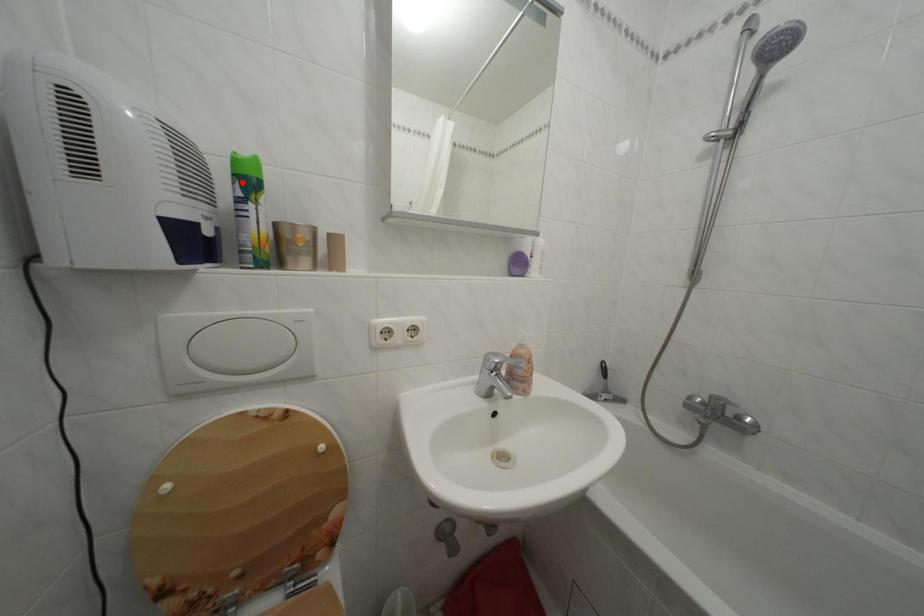
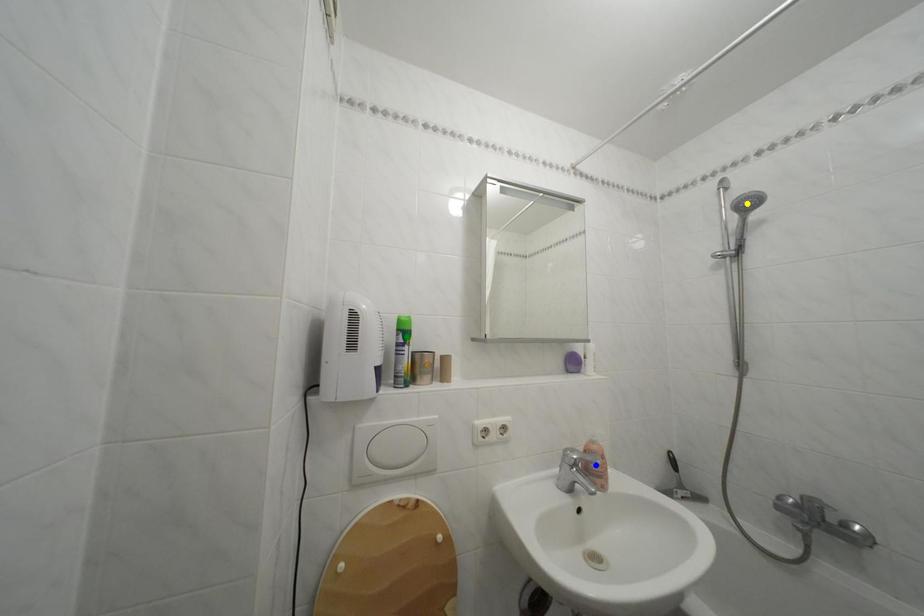
Question: I am providing you with two images of the same scene from different viewpoints. A red point is marked on the first image. You are given multiple points on the second image. Which mark in image 2 goes with the point in image 1?

Choices:
 (A) yellow point
 (B) green point
 (C) blue point

Answer: (B)